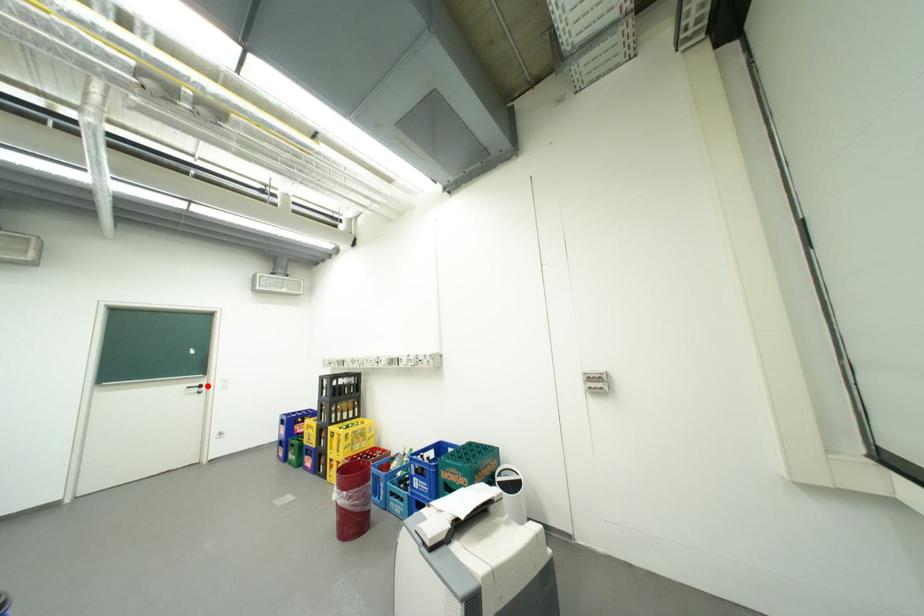
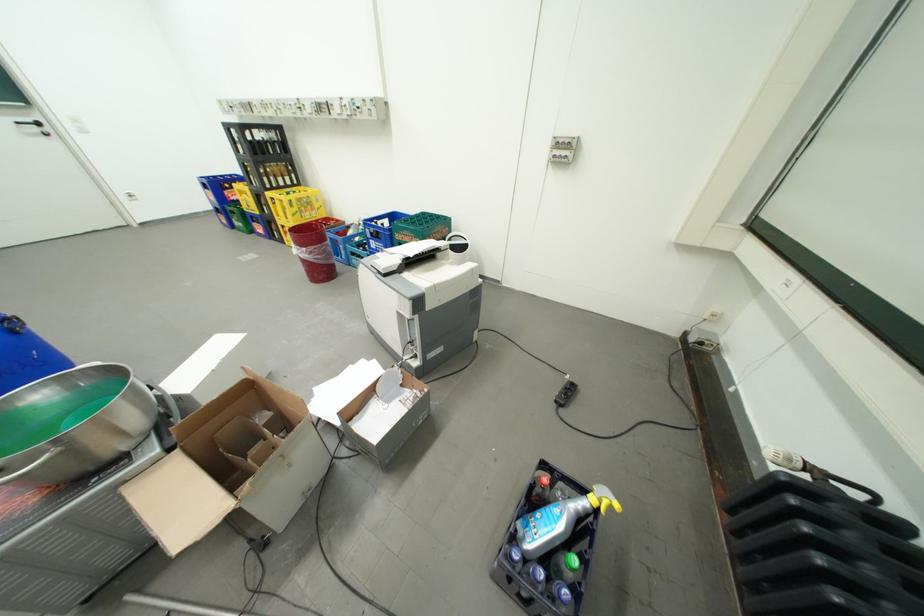
Question: I am providing you with two images of the same scene from different viewpoints. A red point is shown in image1. For the corresponding object point in image2, is it positioned nearer or farther from the camera?

Choices:
 (A) Nearer
 (B) Farther

Answer: (B)